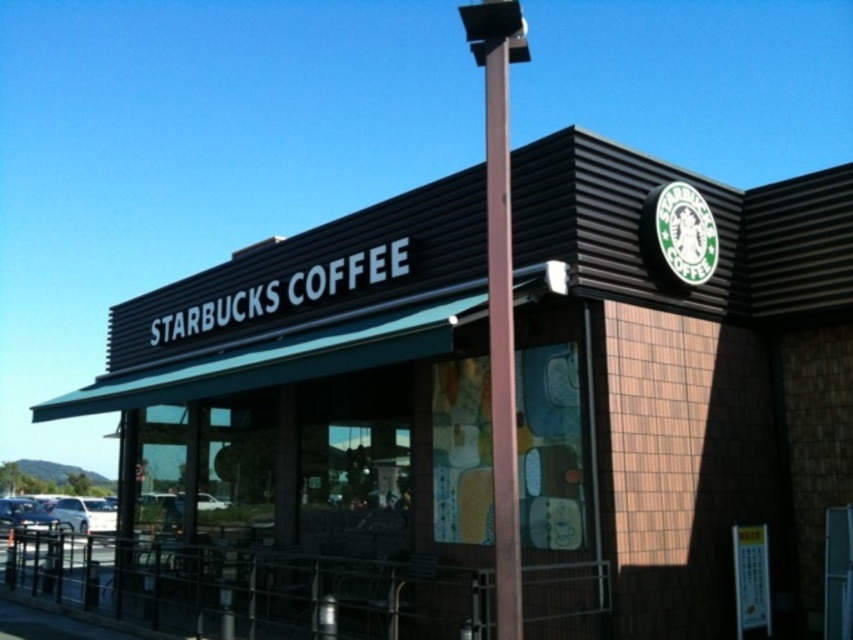
Does white matte car at lower left have a smaller size compared to metallic silver car at lower left?

Correct, white matte car at lower left occupies less space than metallic silver car at lower left.

Does white matte car at lower left appear on the right side of metallic silver car at lower left?

Correct, you'll find white matte car at lower left to the right of metallic silver car at lower left.

Who is more forward, (62, 504) or (50, 522)?

Point (50, 522)

Where is `white matte car at lower left`? white matte car at lower left is located at coordinates (84, 515).

Who is lower down, brown wood pole at center or white matte car at lower left?

Positioned lower is white matte car at lower left.

Between point (498, 403) and point (80, 525), which one is positioned in front?

Point (498, 403) is in front.

Between point (503, 525) and point (97, 518), which one is positioned in front?

Point (503, 525) is more forward.

You are a GUI agent. You are given a task and a screenshot of the screen. Output one action in this format:
    pyautogui.click(x=<x>, y=<y>)
    Task: Click on the brown wood pole at center
    The height and width of the screenshot is (640, 853).
    Given the screenshot: What is the action you would take?
    pyautogui.click(x=500, y=289)

Can you confirm if brown wood pole at center is thinner than metallic silver car at lower left?

Yes, brown wood pole at center is thinner than metallic silver car at lower left.

Is brown wood pole at center to the left of metallic silver car at lower left from the viewer's perspective?

In fact, brown wood pole at center is to the right of metallic silver car at lower left.

Identify the location of brown wood pole at center. (500, 289).